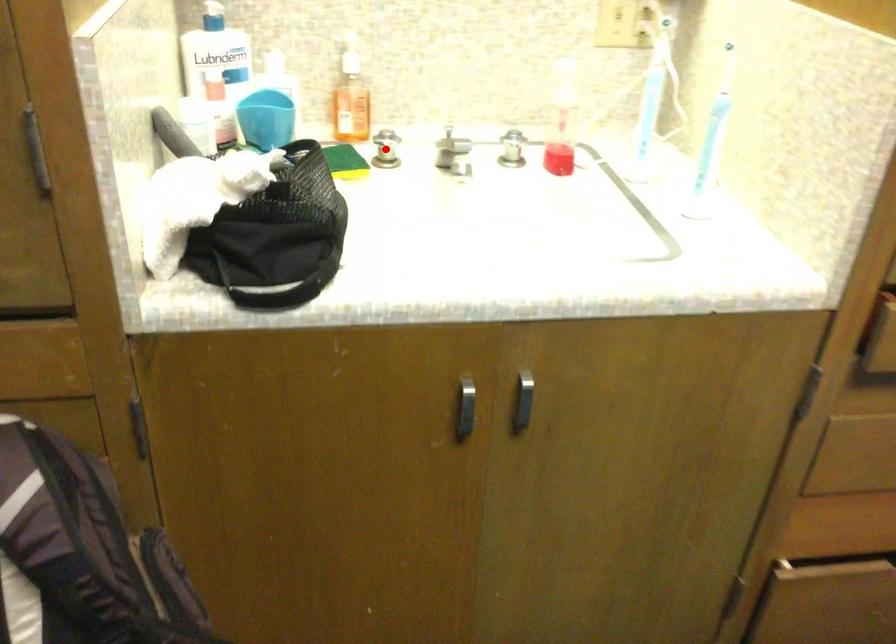
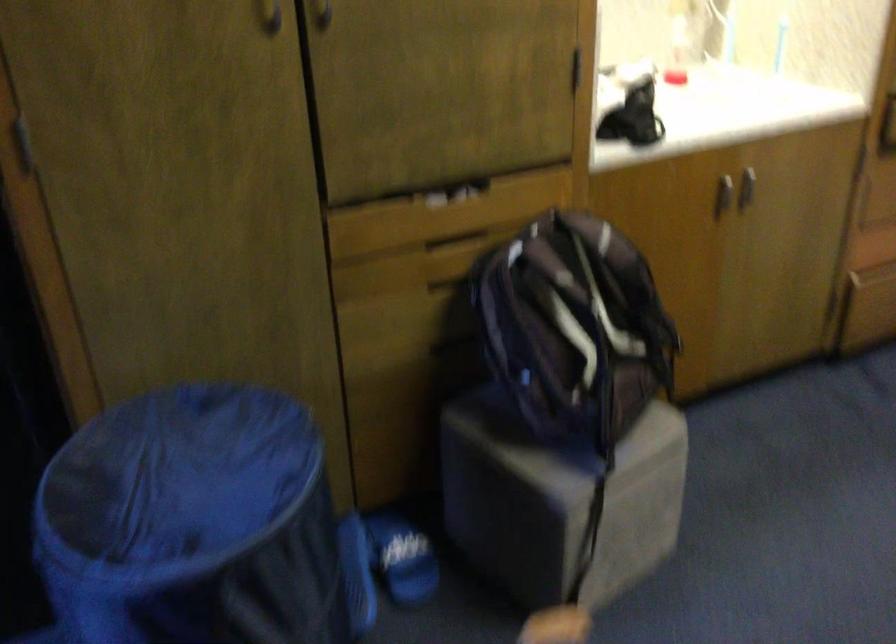
Question: I am providing you with two images of the same scene from different viewpoints. A red point is marked on the first image. Can you still see the location of the red point in image 2?

Choices:
 (A) Yes
 (B) No

Answer: (B)